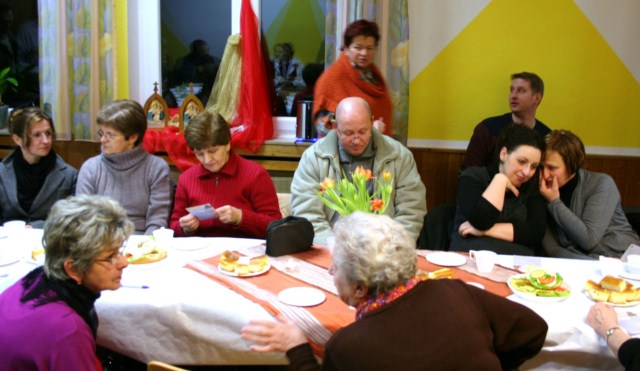
Locate an element on the screen. Image resolution: width=640 pixels, height=371 pixels. orange runner is located at coordinates (335, 309), (314, 259).